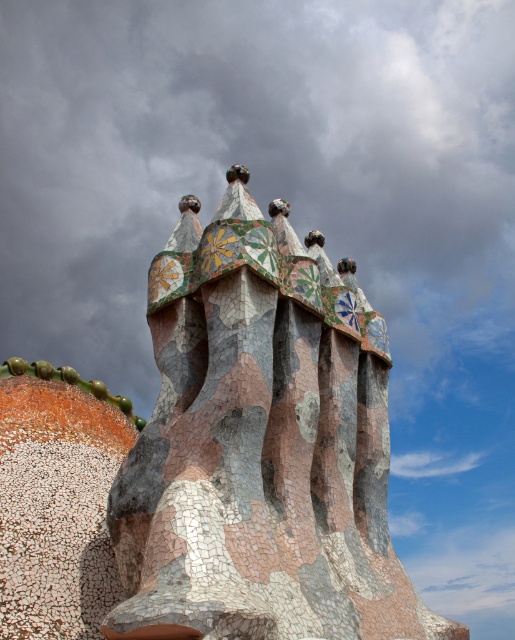
Question: Which point is closer to the camera?

Choices:
 (A) cloudy sky at upper center
 (B) mosaic tile spires at center

Answer: (B)

Question: Which point is farther to the camera?

Choices:
 (A) (237, 124)
 (B) (173, 259)

Answer: (A)

Question: Does cloudy sky at upper center have a larger size compared to mosaic tile spires at center?

Choices:
 (A) yes
 (B) no

Answer: (A)

Question: Does cloudy sky at upper center have a greater width compared to mosaic tile spires at center?

Choices:
 (A) yes
 (B) no

Answer: (A)

Question: Is the position of cloudy sky at upper center more distant than that of mosaic tile spires at center?

Choices:
 (A) yes
 (B) no

Answer: (A)